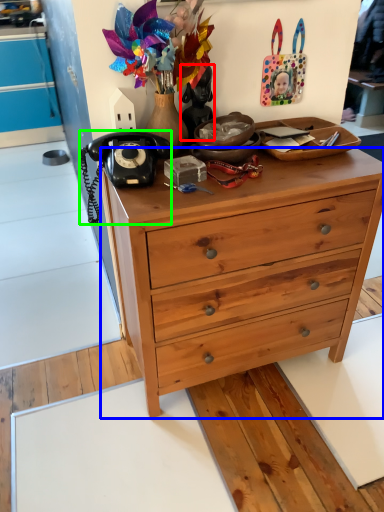
Question: Estimate the real-world distances between objects in this image. Which object is farther from person (highlighted by a red box), desk (highlighted by a blue box) or corded phone (highlighted by a green box)?

Choices:
 (A) desk
 (B) corded phone

Answer: (A)